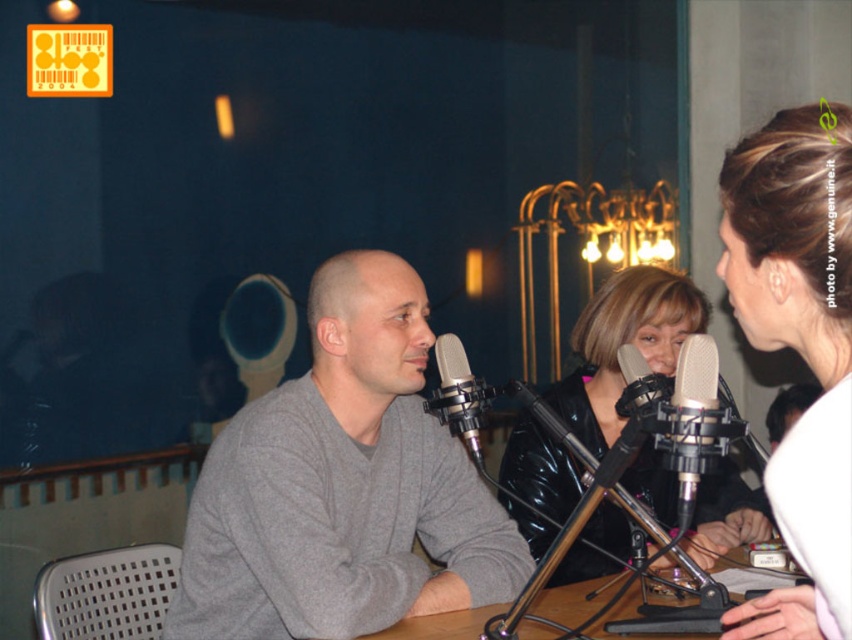
Question: Is gray matte sweater at center positioned behind silver metallic microphone at center?

Choices:
 (A) yes
 (B) no

Answer: (A)

Question: Is gray matte sweater at center bigger than silver metallic microphone at center?

Choices:
 (A) no
 (B) yes

Answer: (B)

Question: Which object is farther from the camera taking this photo?

Choices:
 (A) smooth white blouse at center
 (B) white matte microphone at center
 (C) wooden table at center
 (D) shiny black jacket at center

Answer: (D)

Question: Which point is farther to the camera?

Choices:
 (A) (711, 445)
 (B) (269, 592)
 (C) (766, 170)
 (D) (426, 401)

Answer: (D)

Question: Which of these objects is positioned farthest from the shiny black jacket at center?

Choices:
 (A) white matte microphone at center
 (B) wooden table at center
 (C) silver metallic microphone at center

Answer: (A)

Question: Is smooth white blouse at center wider than shiny black jacket at center?

Choices:
 (A) no
 (B) yes

Answer: (A)